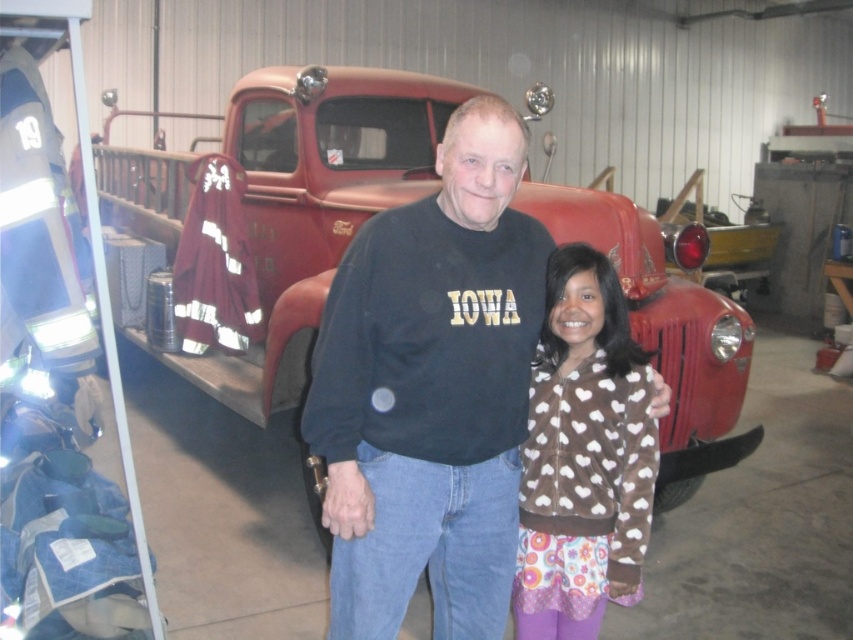
Question: Does black cotton sweatshirt at center appear over metallic red truck at center?

Choices:
 (A) yes
 (B) no

Answer: (B)

Question: Does black cotton sweatshirt at center appear on the left side of metallic red truck at center?

Choices:
 (A) yes
 (B) no

Answer: (B)

Question: Does black cotton sweatshirt at center appear on the left side of metallic red truck at center?

Choices:
 (A) yes
 (B) no

Answer: (B)

Question: Which object is farther from the camera taking this photo?

Choices:
 (A) brown fleece jacket at center
 (B) metallic red truck at center
 (C) black cotton sweatshirt at center

Answer: (B)

Question: Estimate the real-world distances between objects in this image. Which object is closer to the brown fleece jacket at center?

Choices:
 (A) metallic red truck at center
 (B) black cotton sweatshirt at center

Answer: (B)

Question: Which object appears closest to the camera in this image?

Choices:
 (A) brown fleece jacket at center
 (B) metallic red truck at center

Answer: (A)